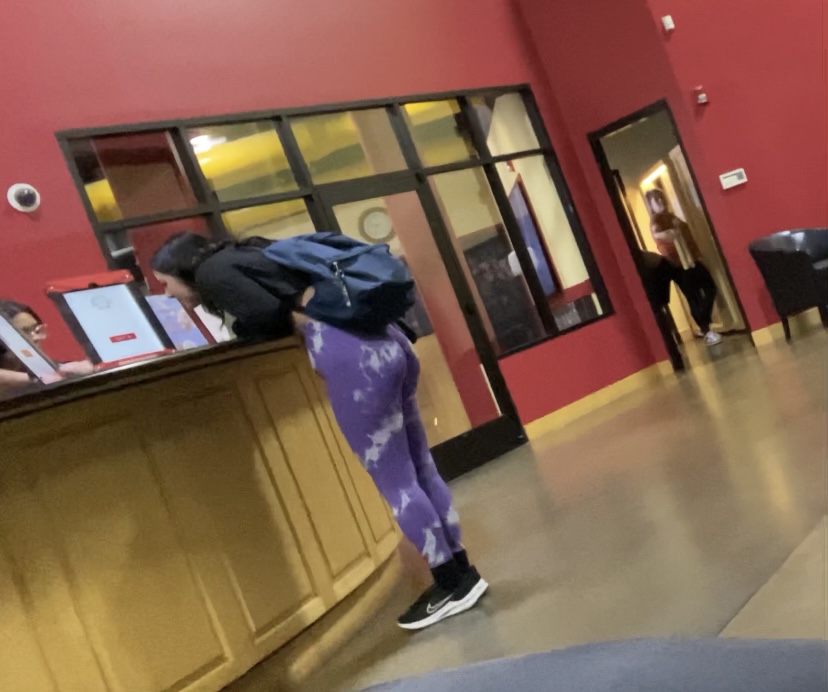
Locate an element on the screen. Image resolution: width=828 pixels, height=692 pixels. computer screen is located at coordinates (133, 329).